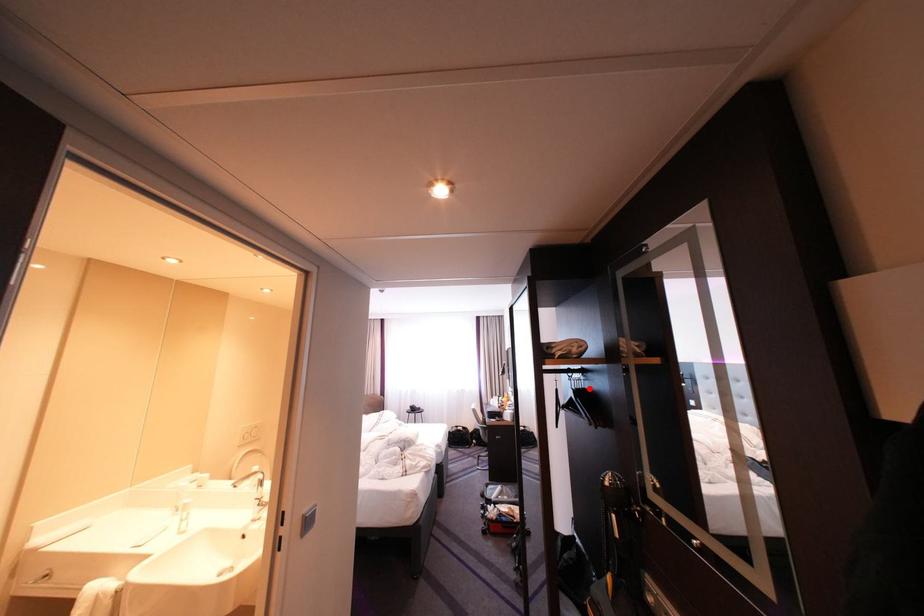
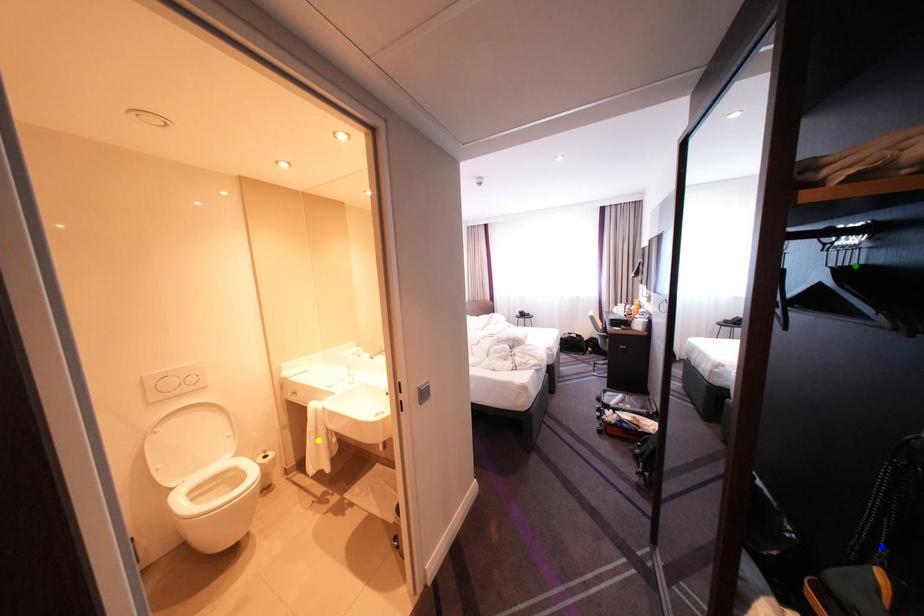
Question: I am providing you with two images of the same scene from different viewpoints. A red point is marked on the first image. You are given multiple points on the second image. In image 2, which mark is for the same physical point as the one in image 1?

Choices:
 (A) blue point
 (B) green point
 (C) yellow point

Answer: (B)